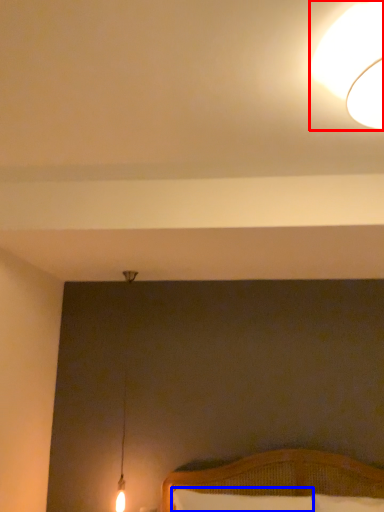
Question: Which point is closer to the camera, lamp (highlighted by a red box) or pillow (highlighted by a blue box)?

Choices:
 (A) lamp
 (B) pillow

Answer: (A)